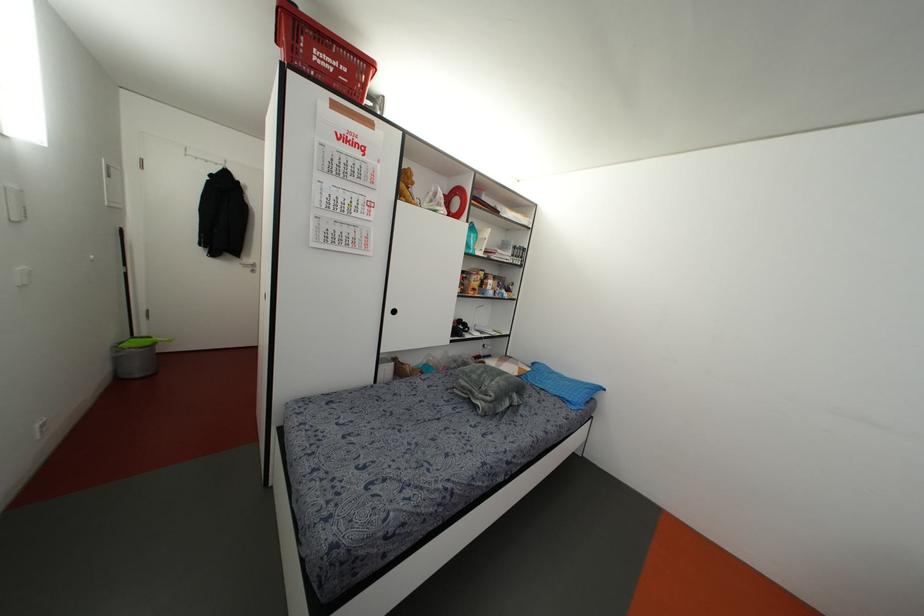
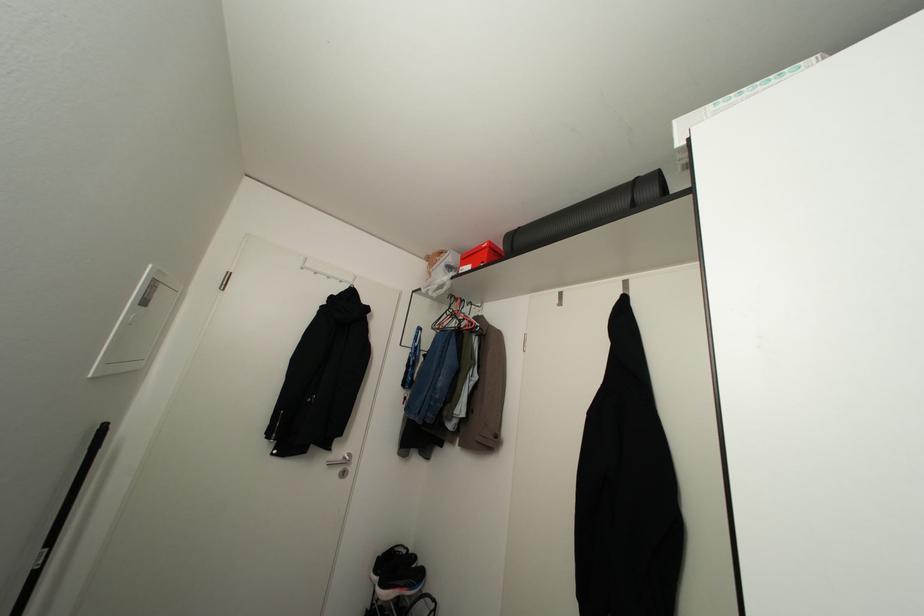
What movement of the cameraman would produce the second image?

The cameraman moved toward left, forward.